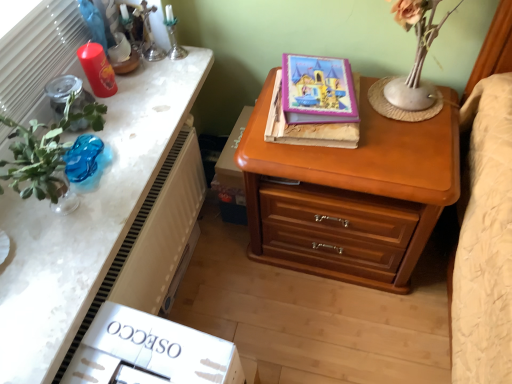
Find the location of a particular element. This screenshot has height=384, width=512. free location in front of wooden chest of drawers at right is located at coordinates (347, 327).